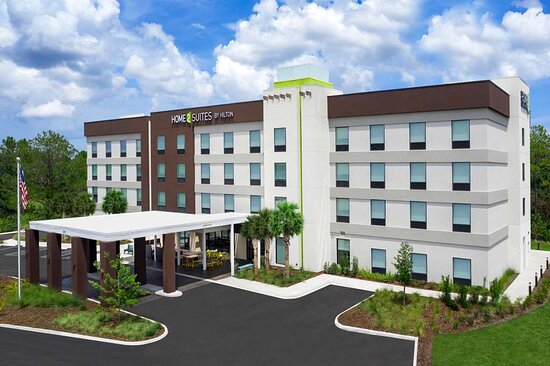
Locate an element on the screen. entrance is located at coordinates (214, 237).